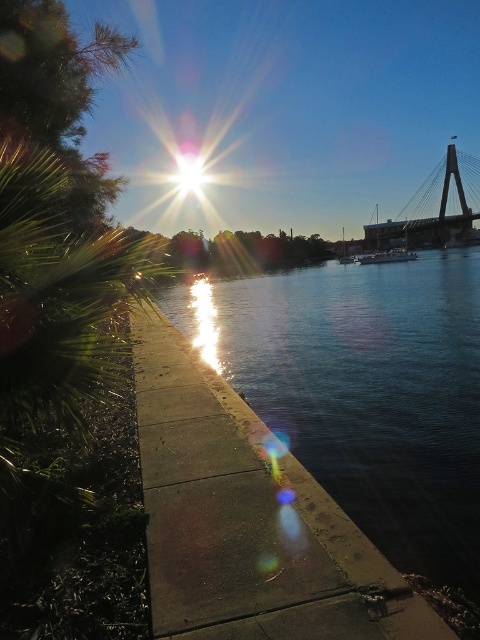
You are a person with a 1.8 meter long ladder. You want to place it on the concrete at center so that it can reach the top of the bush with spiky leaves on the left side. Is the ladder long enough?

The distance between the concrete at center and the bush with spiky leaves on the left side is 2.02 meters. Since the ladder is 1.8 meters long, it is not long enough to reach the top of the bush with spiky leaves on the left side.

You are standing at the center of the image and want to walk to the concrete at center. Which direction should you move to reach it?

The concrete at center is already at the center of the image, so you don not need to move in any direction to reach it.